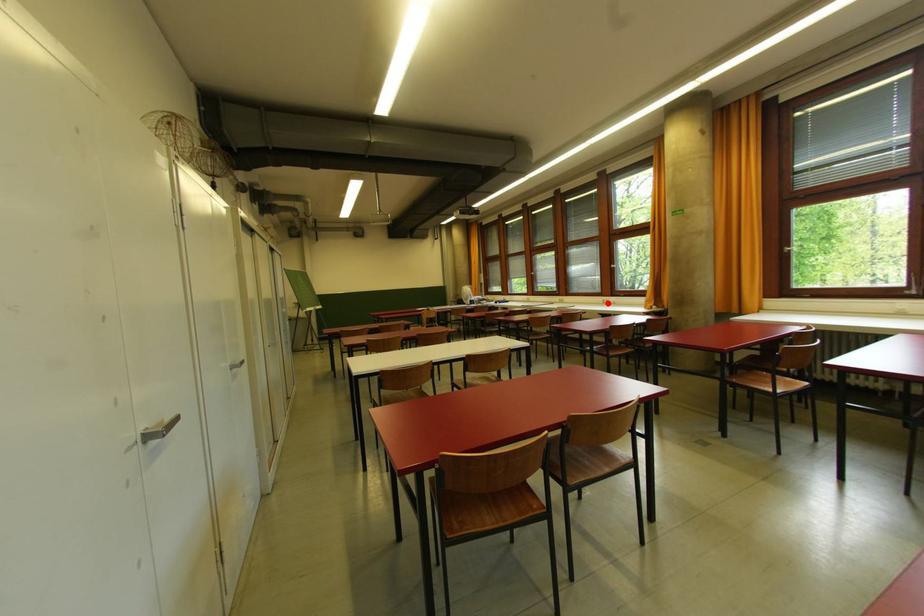
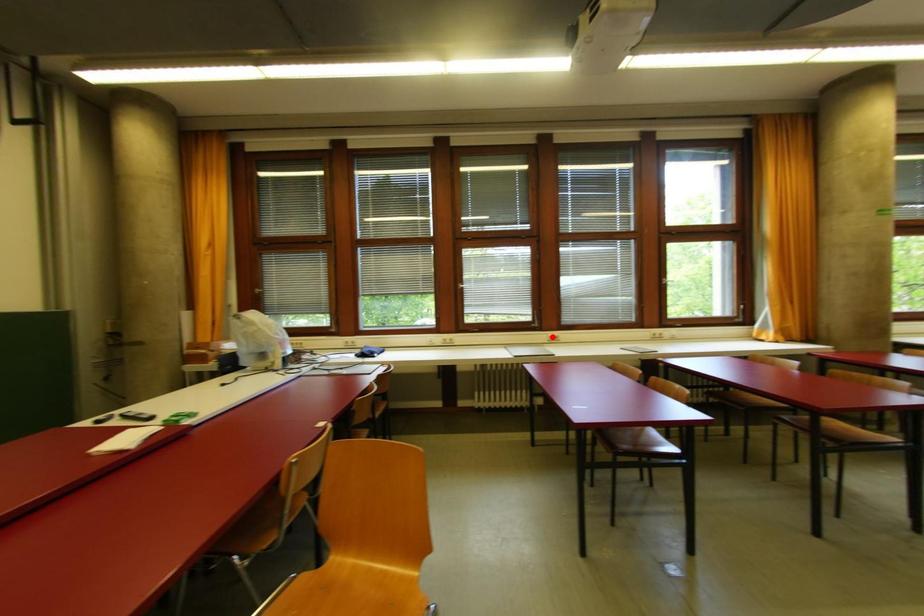
I am providing you with two images of the same scene from different viewpoints. A red point is marked on the first image and another point is marked on the second image. Does the point marked in image1 correspond to the same location as the one in image2?

No